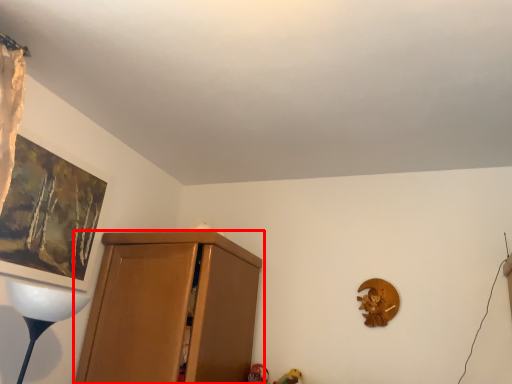
Question: Observing the image, what is the correct spatial positioning of cupboard (annotated by the red box) in reference to picture frame?

Choices:
 (A) left
 (B) right

Answer: (B)